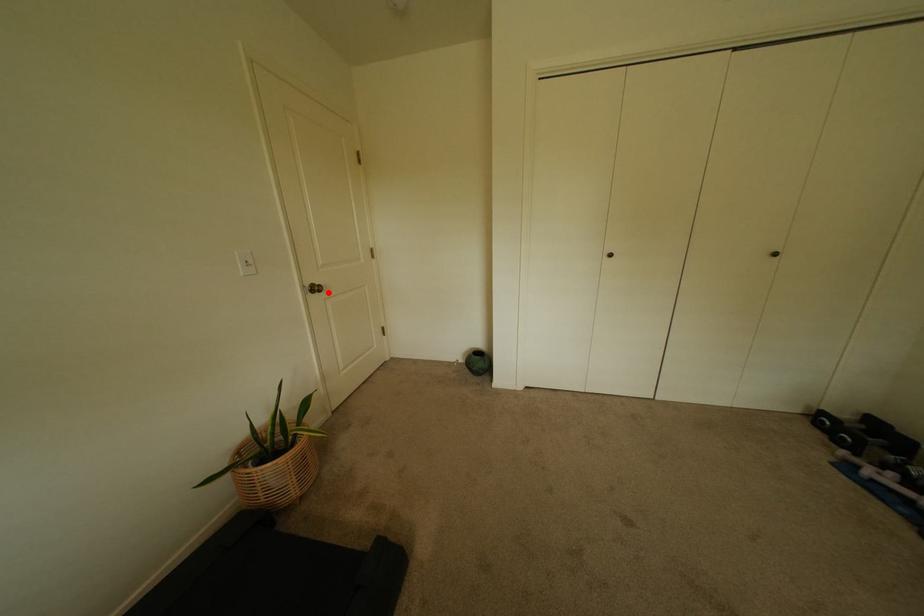
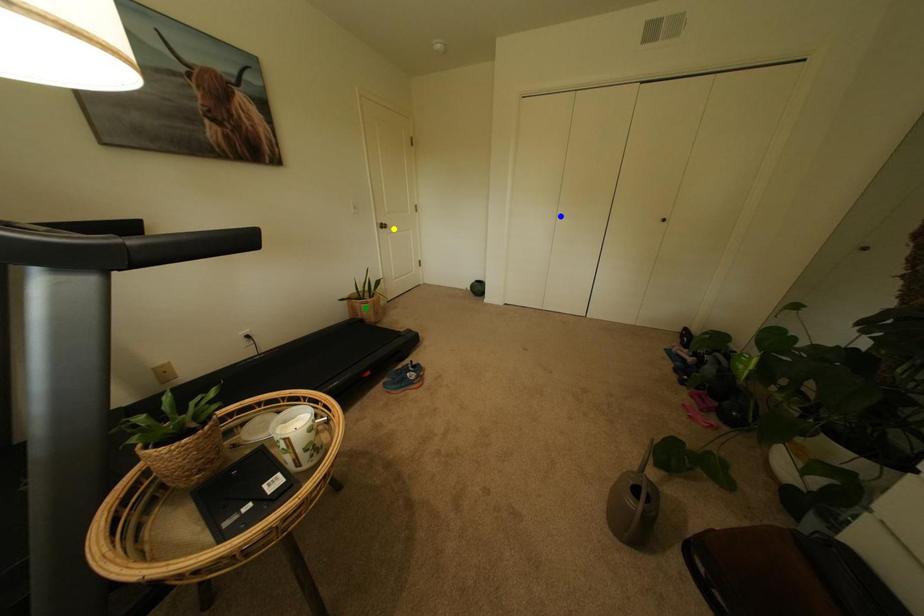
Question: I am providing you with two images of the same scene from different viewpoints. A red point is marked on the first image. You are given multiple points on the second image. Can you choose the point in image 2 that corresponds to the point in image 1?

Choices:
 (A) blue point
 (B) yellow point
 (C) green point

Answer: (B)